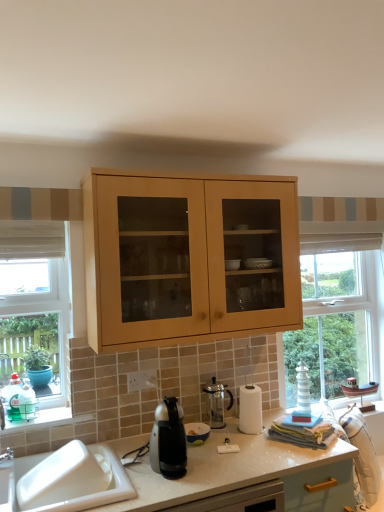
Image resolution: width=384 pixels, height=512 pixels. Identify the location of satin black coffee maker at center. (168, 440).

What do you see at coordinates (196, 433) in the screenshot? The height and width of the screenshot is (512, 384). I see `matte black coffee maker at center, arranged as the first appliance when viewed from the front` at bounding box center [196, 433].

Describe the element at coordinates (31, 352) in the screenshot. Image resolution: width=384 pixels, height=512 pixels. I see `wooden window frame at left` at that location.

Find the location of `white glossy sink at lower left`. white glossy sink at lower left is located at coordinates (98, 492).

Is satin black coffee maker at center positioned behind matte black coffee maker at center, the second appliance viewed from the back?

That is False.

Is satin black coffee maker at center placed right next to matte black coffee maker at center, the second appliance viewed from the back?

satin black coffee maker at center and matte black coffee maker at center, the second appliance viewed from the back, are not in contact.

From the image's perspective, is satin black coffee maker at center located above matte black coffee maker at center, arranged as the first appliance when viewed from the front?

Correct, satin black coffee maker at center appears higher than matte black coffee maker at center, arranged as the first appliance when viewed from the front, in the image.

Does satin black coffee maker at center have a greater width compared to matte black coffee maker at center, the second appliance viewed from the back?

Indeed, satin black coffee maker at center has a greater width compared to matte black coffee maker at center, the second appliance viewed from the back.

Is wooden window frame at left not inside clear glass coffee pot at center, which ranks as the first appliance in back-to-front order?

Absolutely, wooden window frame at left is external to clear glass coffee pot at center, which ranks as the first appliance in back-to-front order.

Is wooden window frame at left to the left of clear glass coffee pot at center, which ranks as the first appliance in back-to-front order, from the viewer's perspective?

Indeed, wooden window frame at left is positioned on the left side of clear glass coffee pot at center, which ranks as the first appliance in back-to-front order.

From the image's perspective, is wooden window frame at left over clear glass coffee pot at center, which ranks as the first appliance in back-to-front order?

Indeed, from the image's perspective, wooden window frame at left is shown above clear glass coffee pot at center, which ranks as the first appliance in back-to-front order.

How much distance is there between wooden window frame at left and clear glass coffee pot at center, which ranks as the first appliance in back-to-front order?

35.53 inches.

Between white glossy sink at lower left and matte black coffee maker at center, arranged as the first appliance when viewed from the front, which one has less height?

With less height is matte black coffee maker at center, arranged as the first appliance when viewed from the front.

Is white glossy sink at lower left positioned behind matte black coffee maker at center, arranged as the first appliance when viewed from the front?

No, white glossy sink at lower left is closer to the camera.

Which is farther from the camera, (116, 497) or (200, 441)?

Positioned behind is point (200, 441).

From a real-world perspective, which is physically below, white glossy sink at lower left or matte black coffee maker at center, arranged as the first appliance when viewed from the front?

From a 3D spatial view, white glossy sink at lower left is below.

Considering the positions of objects clear glass coffee pot at center, which ranks as the first appliance in back-to-front order, and white glossy sink at lower left in the image provided, who is behind, clear glass coffee pot at center, which ranks as the first appliance in back-to-front order, or white glossy sink at lower left?

clear glass coffee pot at center, which ranks as the first appliance in back-to-front order, is further away from the camera.

From the picture: Is clear glass coffee pot at center, acting as the 2th appliance starting from the front, inside the boundaries of white glossy sink at lower left, or outside?

clear glass coffee pot at center, acting as the 2th appliance starting from the front, exists outside the volume of white glossy sink at lower left.

From the image's perspective, is clear glass coffee pot at center, acting as the 2th appliance starting from the front, positioned above or below white glossy sink at lower left?

clear glass coffee pot at center, acting as the 2th appliance starting from the front, is situated higher than white glossy sink at lower left in the image.

From a real-world perspective, who is located higher, clear glass coffee pot at center, which ranks as the first appliance in back-to-front order, or white glossy sink at lower left?

clear glass coffee pot at center, which ranks as the first appliance in back-to-front order, is physically above.

Is satin black coffee maker at center inside the boundaries of wooden window frame at left, or outside?

satin black coffee maker at center is spatially situated outside wooden window frame at left.

Is satin black coffee maker at center to the right of wooden window frame at left from the viewer's perspective?

Indeed, satin black coffee maker at center is positioned on the right side of wooden window frame at left.

From a real-world perspective, does satin black coffee maker at center stand above wooden window frame at left?

No, from a real-world perspective, satin black coffee maker at center is not over wooden window frame at left

Does wooden window frame at left appear on the left side of matte black coffee maker at center, the second appliance viewed from the back?

Yes.

Is point (51, 325) closer or farther from the camera than point (191, 425)?

Point (51, 325) is farther from the camera than point (191, 425).

Is wooden window frame at left looking in the opposite direction of matte black coffee maker at center, the second appliance viewed from the back?

wooden window frame at left is not turned away from matte black coffee maker at center, the second appliance viewed from the back.

Which object is wider, wooden window frame at left or matte black coffee maker at center, arranged as the first appliance when viewed from the front?

Wider between the two is matte black coffee maker at center, arranged as the first appliance when viewed from the front.

Which object is positioned more to the left, white glossy sink at lower left or clear glass coffee pot at center, acting as the 2th appliance starting from the front?

From the viewer's perspective, white glossy sink at lower left appears more on the left side.

From a real-world perspective, is white glossy sink at lower left physically located above or below clear glass coffee pot at center, which ranks as the first appliance in back-to-front order?

Clearly, from a real-world perspective, white glossy sink at lower left is below clear glass coffee pot at center, which ranks as the first appliance in back-to-front order.

Is white glossy sink at lower left in front of clear glass coffee pot at center, acting as the 2th appliance starting from the front?

Yes, the depth of white glossy sink at lower left is less than that of clear glass coffee pot at center, acting as the 2th appliance starting from the front.

This screenshot has height=512, width=384. I want to click on kitchen appliance that appears above the matte black coffee maker at center, arranged as the first appliance when viewed from the front (from the image's perspective), so click(168, 440).

Find the location of a particular element. The height and width of the screenshot is (512, 384). window frame in front of the clear glass coffee pot at center, acting as the 2th appliance starting from the front is located at coordinates (31, 352).

Which object lies nearer to the anchor point white glossy sink at lower left, clear glass coffee pot at center, which ranks as the first appliance in back-to-front order, or wooden window frame at left?

wooden window frame at left is closer to white glossy sink at lower left.

Looking at the image, which one is located closer to white glossy sink at lower left, matte black coffee maker at center, arranged as the first appliance when viewed from the front, or satin black coffee maker at center?

The object closer to white glossy sink at lower left is satin black coffee maker at center.

Estimate the real-world distances between objects in this image. Which object is further from wooden window frame at left, satin black coffee maker at center or matte black coffee maker at center, arranged as the first appliance when viewed from the front?

The object further to wooden window frame at left is matte black coffee maker at center, arranged as the first appliance when viewed from the front.

Based on their spatial positions, is clear glass coffee pot at center, acting as the 2th appliance starting from the front, or matte black coffee maker at center, arranged as the first appliance when viewed from the front, further from wooden window frame at left?

The object further to wooden window frame at left is clear glass coffee pot at center, acting as the 2th appliance starting from the front.

Looking at the image, which one is located closer to clear glass coffee pot at center, acting as the 2th appliance starting from the front, satin black coffee maker at center or wooden window frame at left?

satin black coffee maker at center is closer to clear glass coffee pot at center, acting as the 2th appliance starting from the front.

When comparing their distances from matte black coffee maker at center, arranged as the first appliance when viewed from the front, does satin black coffee maker at center or clear glass coffee pot at center, acting as the 2th appliance starting from the front, seem closer?

clear glass coffee pot at center, acting as the 2th appliance starting from the front, lies closer to matte black coffee maker at center, arranged as the first appliance when viewed from the front, than the other object.

Looking at the image, which one is located closer to satin black coffee maker at center, white glossy sink at lower left or wooden window frame at left?

white glossy sink at lower left.

Looking at the image, which one is located further to matte black coffee maker at center, the second appliance viewed from the back, clear glass coffee pot at center, which ranks as the first appliance in back-to-front order, or wooden window frame at left?

wooden window frame at left is further to matte black coffee maker at center, the second appliance viewed from the back.

Image resolution: width=384 pixels, height=512 pixels. What are the coordinates of `appliance between white glossy sink at lower left and clear glass coffee pot at center, acting as the 2th appliance starting from the front, along the z-axis` in the screenshot? It's located at (196, 433).

The width and height of the screenshot is (384, 512). I want to click on kitchen appliance situated between wooden window frame at left and matte black coffee maker at center, arranged as the first appliance when viewed from the front, from left to right, so coord(168,440).

Locate an element on the screen. appliance between satin black coffee maker at center and clear glass coffee pot at center, which ranks as the first appliance in back-to-front order, along the z-axis is located at coordinates (196, 433).

Find the location of `appliance between wooden window frame at left and clear glass coffee pot at center, which ranks as the first appliance in back-to-front order, from left to right`. appliance between wooden window frame at left and clear glass coffee pot at center, which ranks as the first appliance in back-to-front order, from left to right is located at coordinates (196, 433).